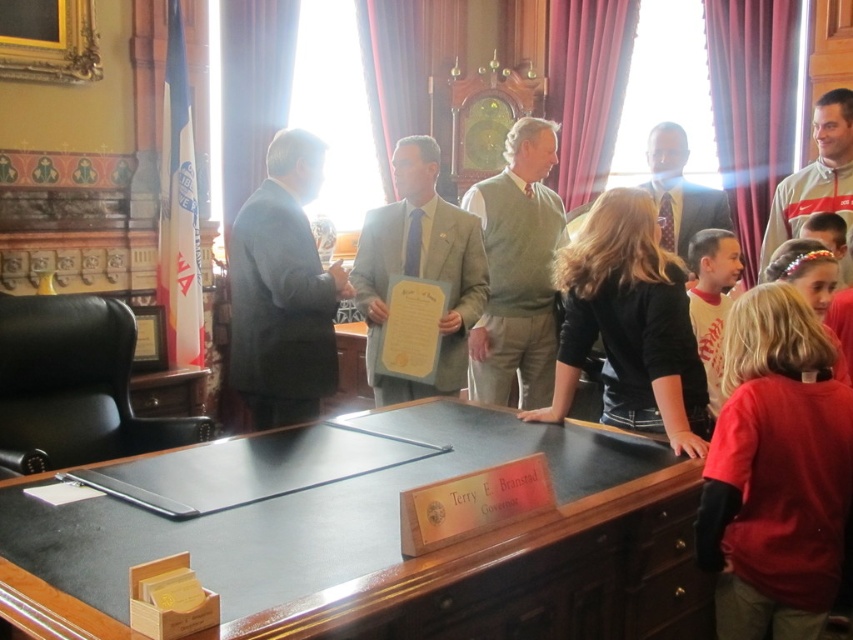
How distant is black matte shirt at center from matte gray suit at center?

A distance of 4.90 feet exists between black matte shirt at center and matte gray suit at center.

Image resolution: width=853 pixels, height=640 pixels. What are the coordinates of `black matte shirt at center` in the screenshot? It's located at (628, 324).

Is point (640, 413) positioned behind point (664, 202)?

No.

This screenshot has height=640, width=853. I want to click on black matte shirt at center, so click(628, 324).

Between point (537, 262) and point (683, 230), which one is positioned behind?

The point (683, 230) is more distant.

Is light green sweater at center to the right of matte gray suit at center from the viewer's perspective?

No, light green sweater at center is not to the right of matte gray suit at center.

What do you see at coordinates (517, 269) in the screenshot? I see `light green sweater at center` at bounding box center [517, 269].

Where is `light green sweater at center`? Image resolution: width=853 pixels, height=640 pixels. light green sweater at center is located at coordinates (517, 269).

Can you confirm if light green sweater at center is positioned to the right of gray fleece jacket at upper right?

Incorrect, light green sweater at center is not on the right side of gray fleece jacket at upper right.

Is light green sweater at center to the left of gray fleece jacket at upper right from the viewer's perspective?

Yes, light green sweater at center is to the left of gray fleece jacket at upper right.

Is point (498, 204) farther from viewer compared to point (816, 140)?

No, (498, 204) is in front of (816, 140).

Locate an element on the screen. light green sweater at center is located at coordinates (517, 269).